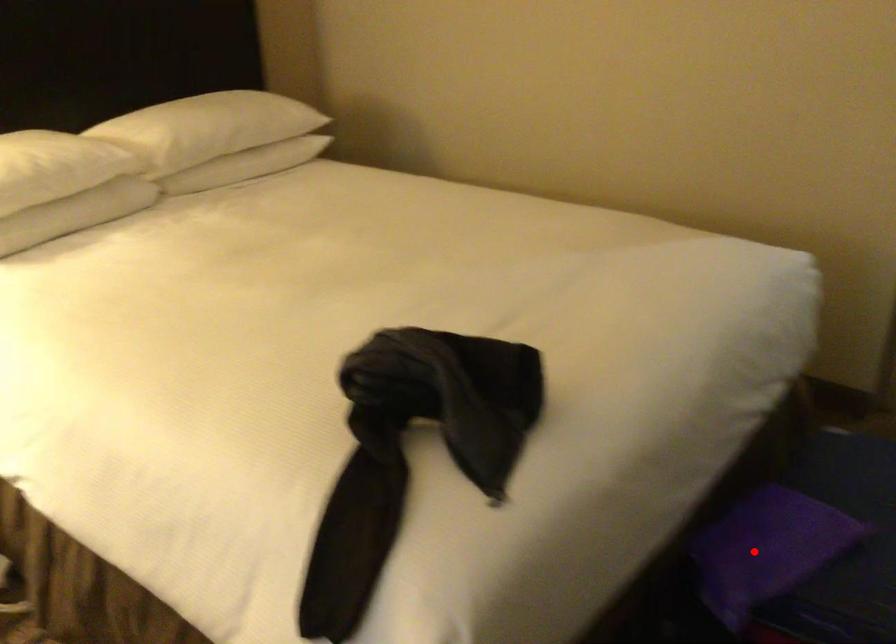
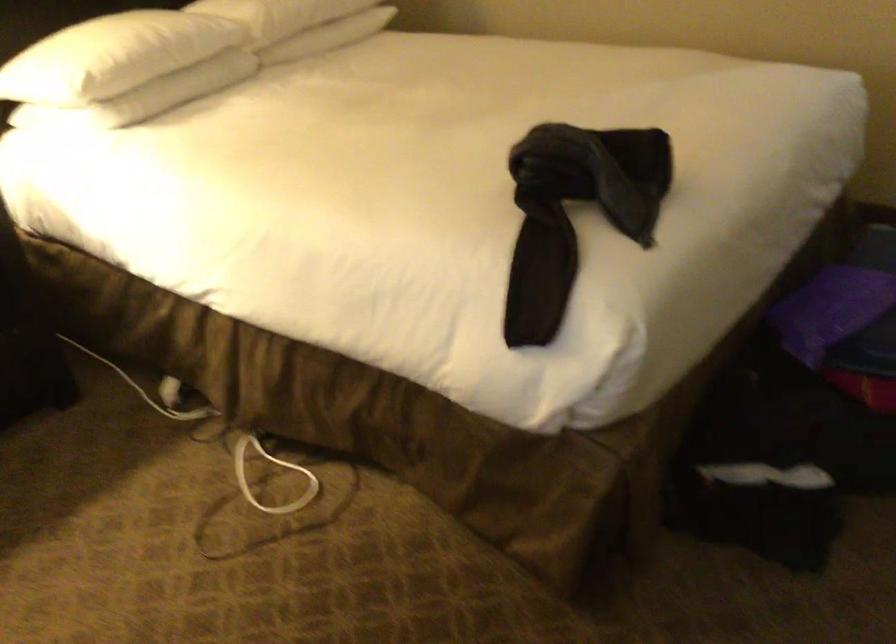
Find the pixel in the second image that matches the highlighted location in the first image.

(831, 310)